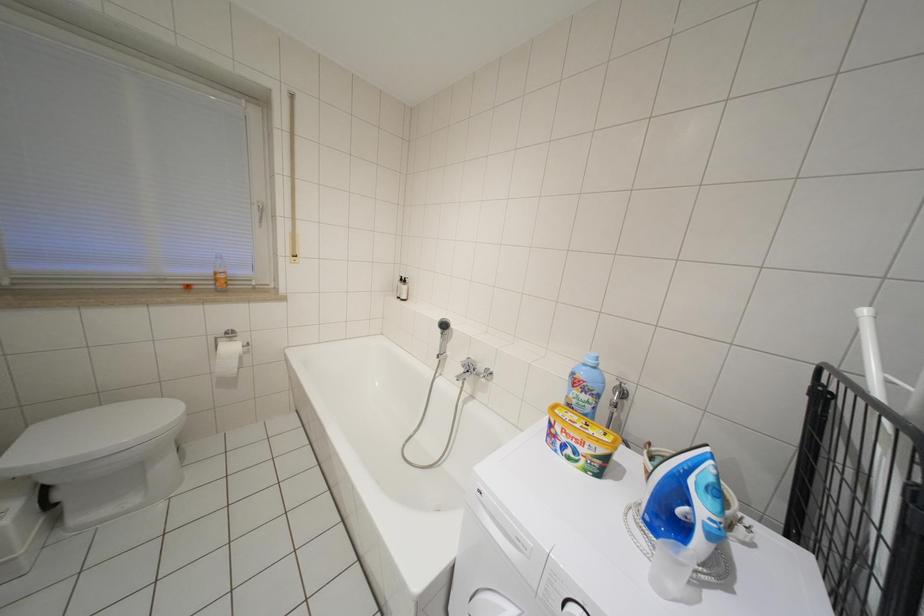
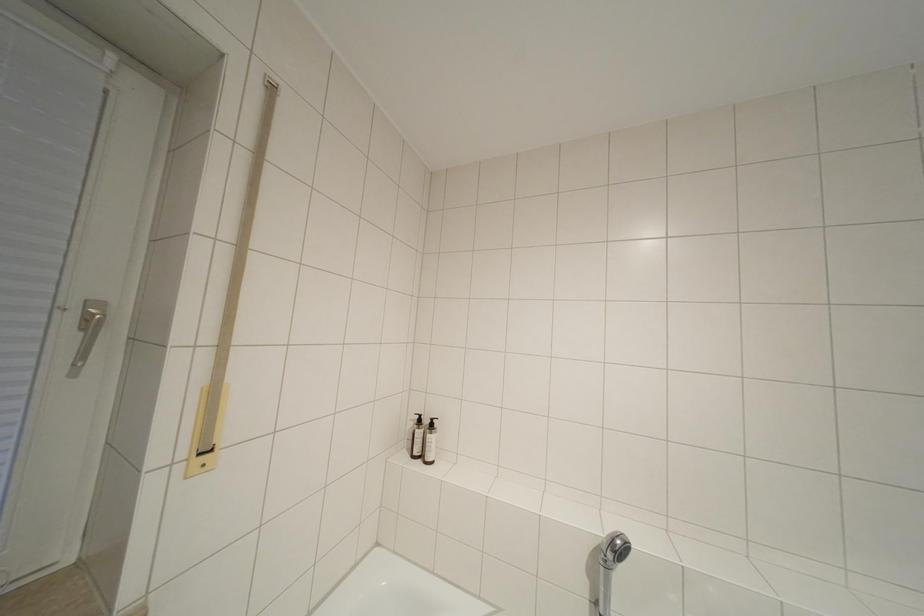
Which direction would the cameraman need to move to produce the second image?

The cameraman moved toward left, forward.